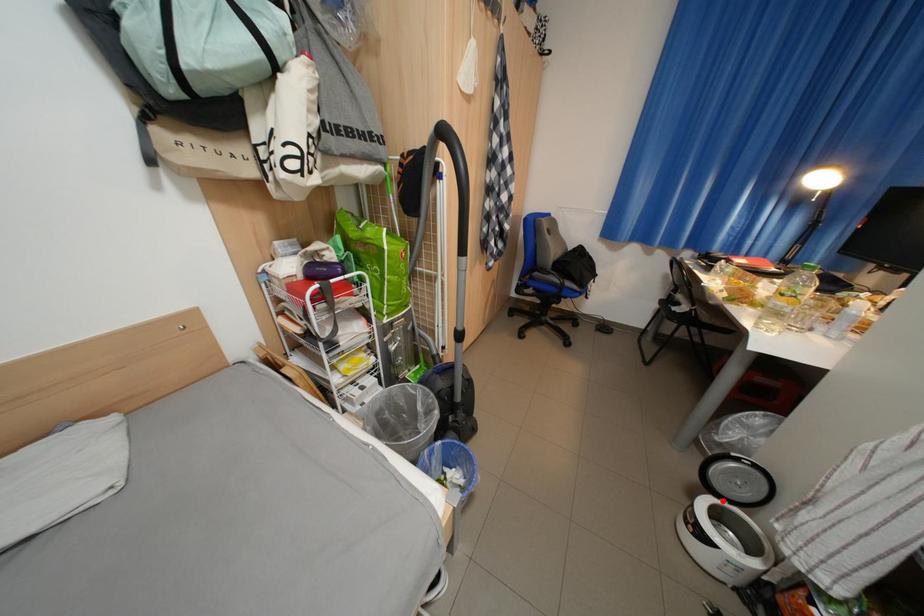
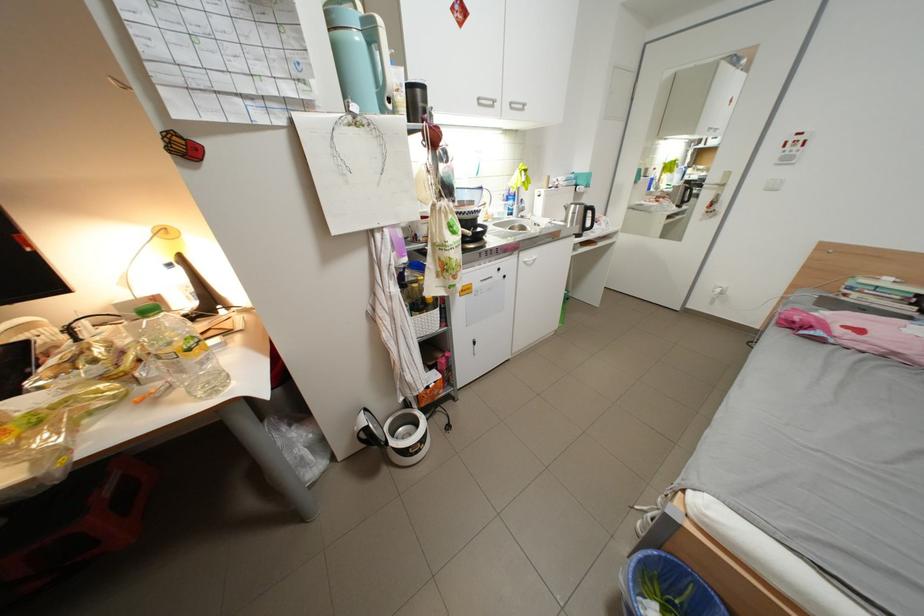
Question: I am providing you with two images of the same scene from different viewpoints. Image1 has a red point marked. In image2, the corresponding 3D location appears at what relative position? Reply with the corresponding letter.

Choices:
 (A) Closer
 (B) Farther

Answer: (A)